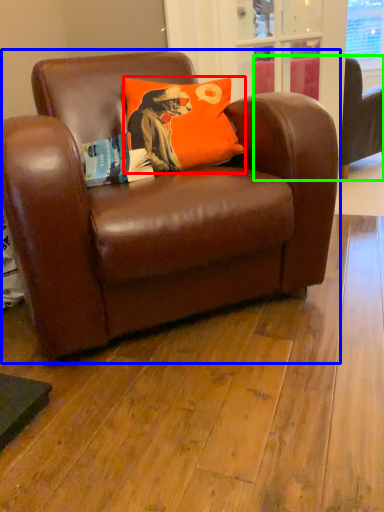
Question: Based on their relative distances, which object is nearer to pillow (highlighted by a red box)? Choose from chair (highlighted by a blue box) and studio couch (highlighted by a green box).

Choices:
 (A) chair
 (B) studio couch

Answer: (A)